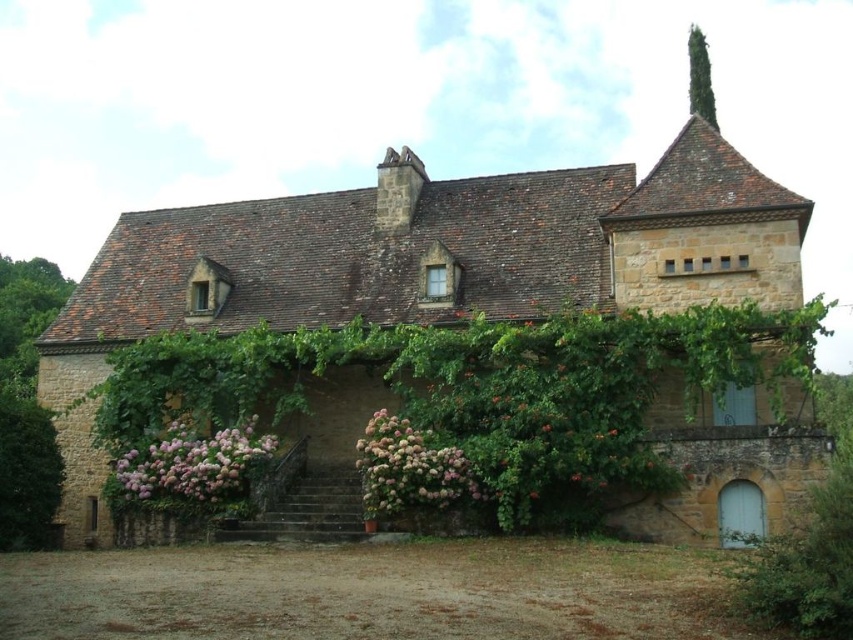
Who is positioned more to the left, brown stone cottage at center or pink matte hydrangea at center?

From the viewer's perspective, brown stone cottage at center appears more on the left side.

What do you see at coordinates (440, 253) in the screenshot?
I see `brown stone cottage at center` at bounding box center [440, 253].

Identify the location of brown stone cottage at center. This screenshot has height=640, width=853. click(x=440, y=253).

Is pink fluffy flowers at lower left bigger than pink matte hydrangea at center?

Incorrect, pink fluffy flowers at lower left is not larger than pink matte hydrangea at center.

Describe the element at coordinates (195, 465) in the screenshot. I see `pink fluffy flowers at lower left` at that location.

Which is behind, point (265, 442) or point (363, 499)?

The point (265, 442) is behind.

At what (x,y) coordinates should I click in order to perform the action: click on pink fluffy flowers at lower left. Please return your answer as a coordinate pair (x, y). Looking at the image, I should click on (195, 465).

Can you confirm if brown stone cottage at center is positioned to the left of pink fluffy flowers at lower left?

Incorrect, brown stone cottage at center is not on the left side of pink fluffy flowers at lower left.

Is brown stone cottage at center thinner than pink fluffy flowers at lower left?

No, brown stone cottage at center is not thinner than pink fluffy flowers at lower left.

Is point (547, 282) less distant than point (239, 477)?

No, (547, 282) is behind (239, 477).

The height and width of the screenshot is (640, 853). Find the location of `brown stone cottage at center`. brown stone cottage at center is located at coordinates (x=440, y=253).